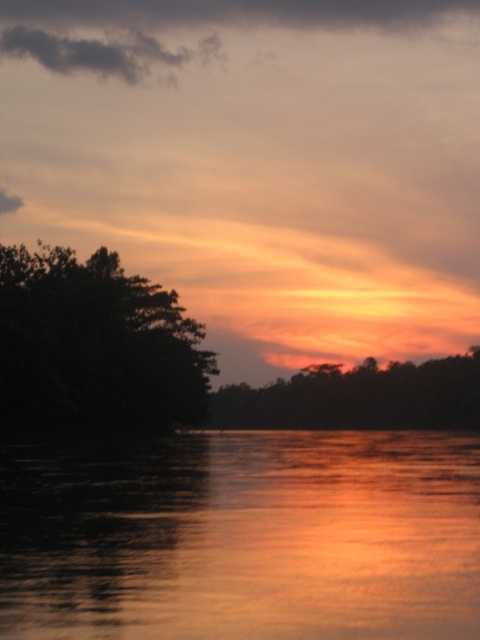
Can you confirm if glossy water at center is positioned to the left of dark green leafy tree at left?

In fact, glossy water at center is to the right of dark green leafy tree at left.

Is glossy water at center shorter than dark green leafy tree at left?

Correct, glossy water at center is not as tall as dark green leafy tree at left.

Is point (205, 452) positioned before point (84, 376)?

Yes, it is.

Identify the location of glossy water at center. (242, 536).

Who is taller, dark green leafy tree at left or silhouette tree at center?

dark green leafy tree at left is taller.

Can you confirm if dark green leafy tree at left is taller than silhouette tree at center?

Indeed, dark green leafy tree at left has a greater height compared to silhouette tree at center.

You are a GUI agent. You are given a task and a screenshot of the screen. Output one action in this format:
    pyautogui.click(x=<x>, y=<y>)
    Task: Click on the dark green leafy tree at left
    
    Given the screenshot: What is the action you would take?
    pyautogui.click(x=95, y=346)

Find the location of `dark green leafy tree at left`. dark green leafy tree at left is located at coordinates (95, 346).

Is the position of glossy water at center less distant than that of silhouette tree at center?

Yes, it is in front of silhouette tree at center.

Consider the image. Does glossy water at center come behind silhouette tree at center?

That is False.

Who is more forward, (442, 604) or (312, 403)?

Positioned in front is point (442, 604).

The width and height of the screenshot is (480, 640). Find the location of `glossy water at center`. glossy water at center is located at coordinates (242, 536).